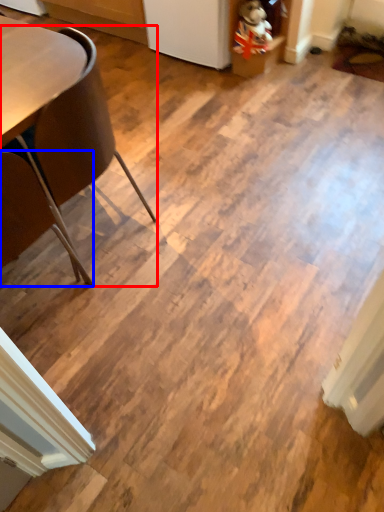
Question: Which point is further to the camera, chair (highlighted by a red box) or chair (highlighted by a blue box)?

Choices:
 (A) chair
 (B) chair

Answer: (A)